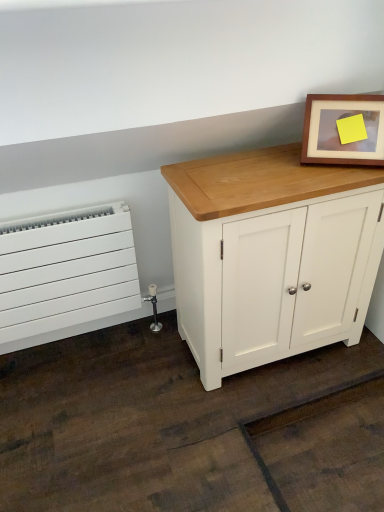
Where is `vacant area to the right of white matte radiator at left`? This screenshot has height=512, width=384. vacant area to the right of white matte radiator at left is located at coordinates (150, 366).